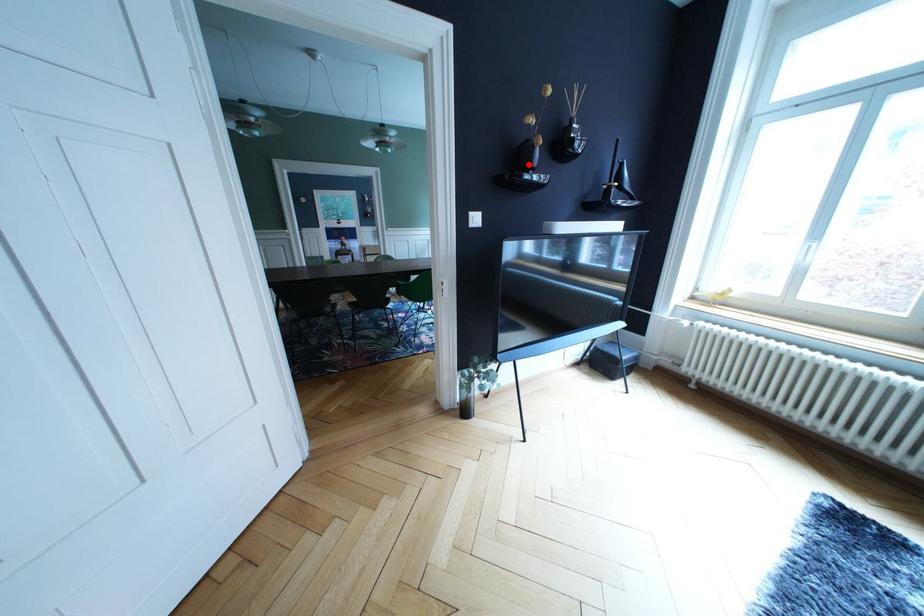
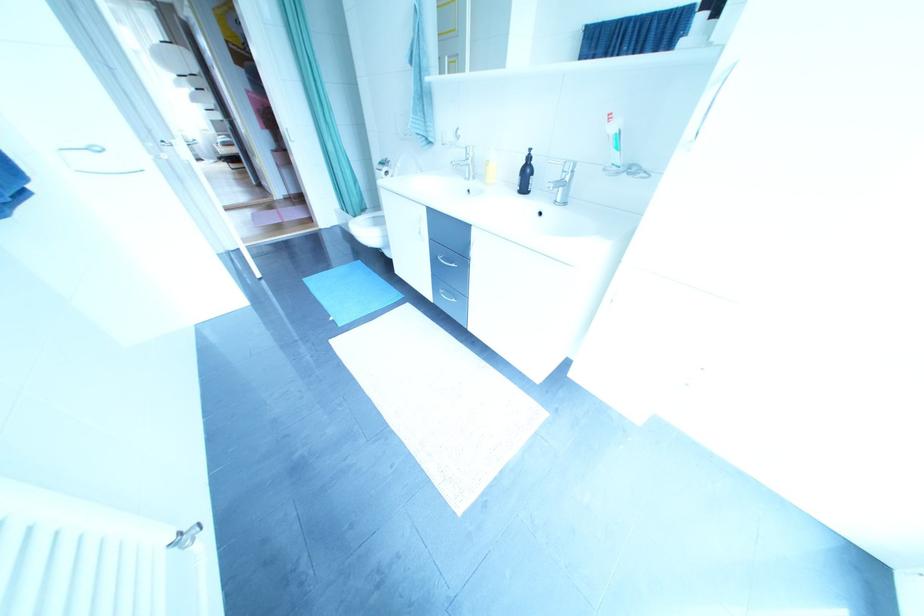
Question: I am providing you with two images of the same scene from different viewpoints. A red point is marked on the first image. Is the red point's position out of view in image 2?

Choices:
 (A) Yes
 (B) No

Answer: (A)